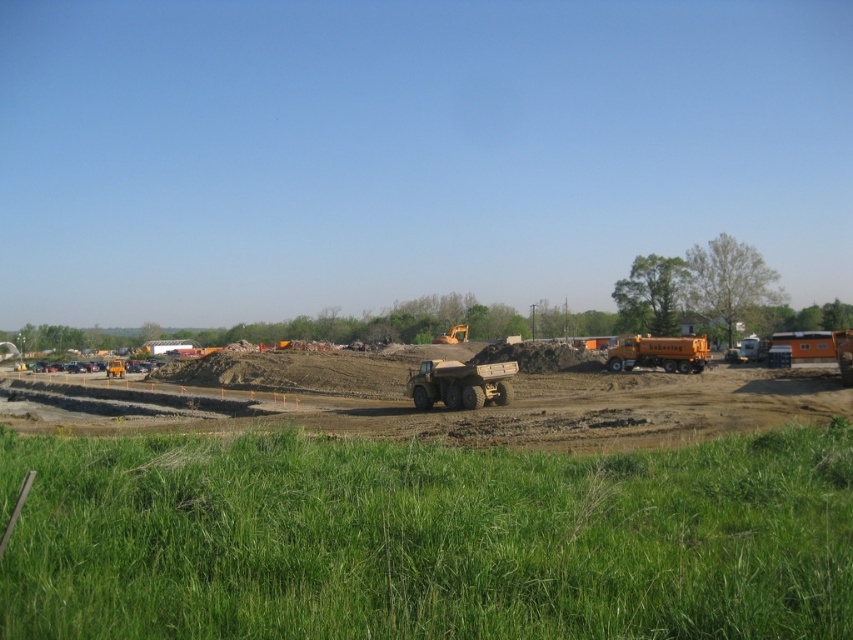
You are standing at the camera position and want to walk to the green grass at lower center. Is the distance within a 4 meter limit?

The distance between the green grass at lower center and the camera is 3.80 meters, which is within the 4 meter limit.

You are a construction worker who needs to move a heavy equipment from the green grass at lower center to the matte yellow truck at center. Considering the space available, will the equipment fit through the area between them?

The green grass at lower center occupies less space than the matte yellow truck at center, so the equipment might not have enough space to maneuver from the green grass at lower center to the matte yellow truck at center. Check the available space carefully before moving.

You are a construction worker standing on the green grass at lower center. You need to walk to the matte yellow truck at center. Which direction should you move to reach it?

The green grass at lower center is above the matte yellow truck at center, so you should move downward to reach the matte yellow truck at center.